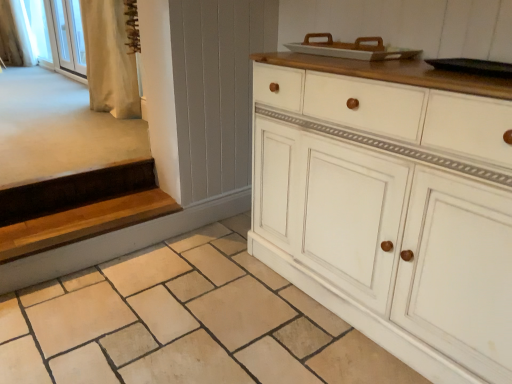
Image resolution: width=512 pixels, height=384 pixels. Find the location of `vacant region below white glass screen door at upper left (from a real-world perspective)`. vacant region below white glass screen door at upper left (from a real-world perspective) is located at coordinates (x=64, y=73).